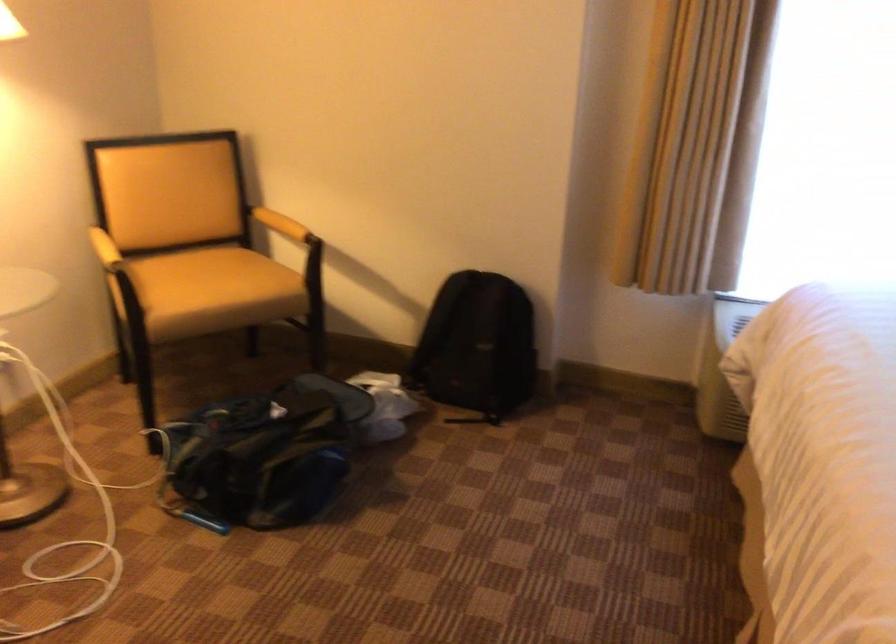
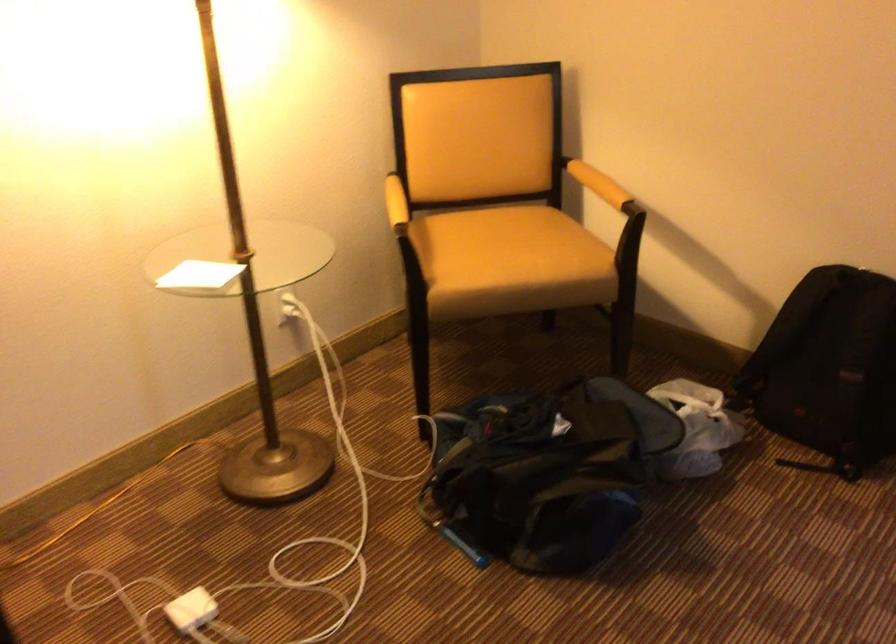
The point at (285, 220) is marked in the first image. Where is the corresponding point in the second image?

(598, 184)